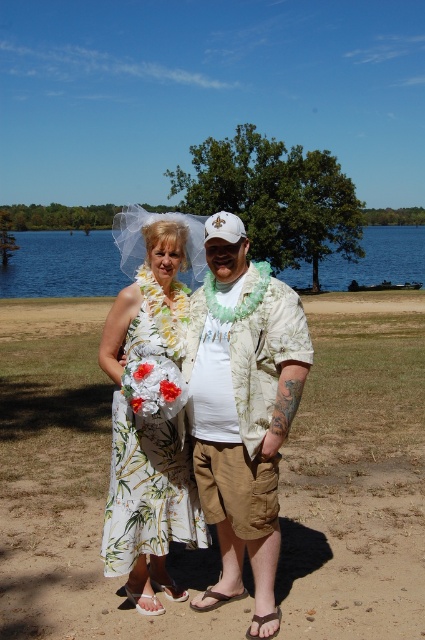
Question: Can you confirm if hawaiian print shirt at center is positioned above white floral dress at center?

Choices:
 (A) yes
 (B) no

Answer: (A)

Question: Is hawaiian print shirt at center smaller than white floral dress at center?

Choices:
 (A) yes
 (B) no

Answer: (B)

Question: Is hawaiian print shirt at center positioned at the back of white floral dress at center?

Choices:
 (A) no
 (B) yes

Answer: (B)

Question: Which object is positioned closest to the blue water at center?

Choices:
 (A) hawaiian print shirt at center
 (B) white floral dress at center

Answer: (B)

Question: Which point is closer to the camera taking this photo?

Choices:
 (A) (115, 509)
 (B) (235, 595)
 (C) (93, 292)

Answer: (A)

Question: Estimate the real-world distances between objects in this image. Which object is closer to the white floral dress at center?

Choices:
 (A) hawaiian print shirt at center
 (B) blue water at center

Answer: (A)